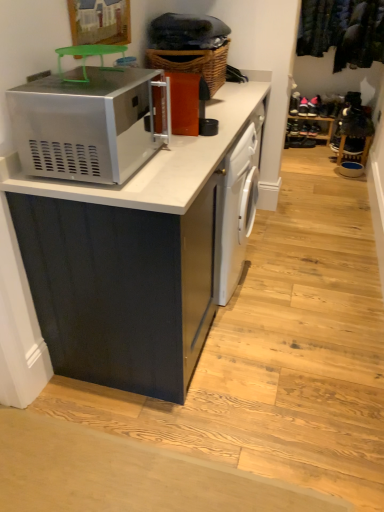
This screenshot has width=384, height=512. Find the location of `free spot in front of white glossy dishwasher at center`. free spot in front of white glossy dishwasher at center is located at coordinates (258, 325).